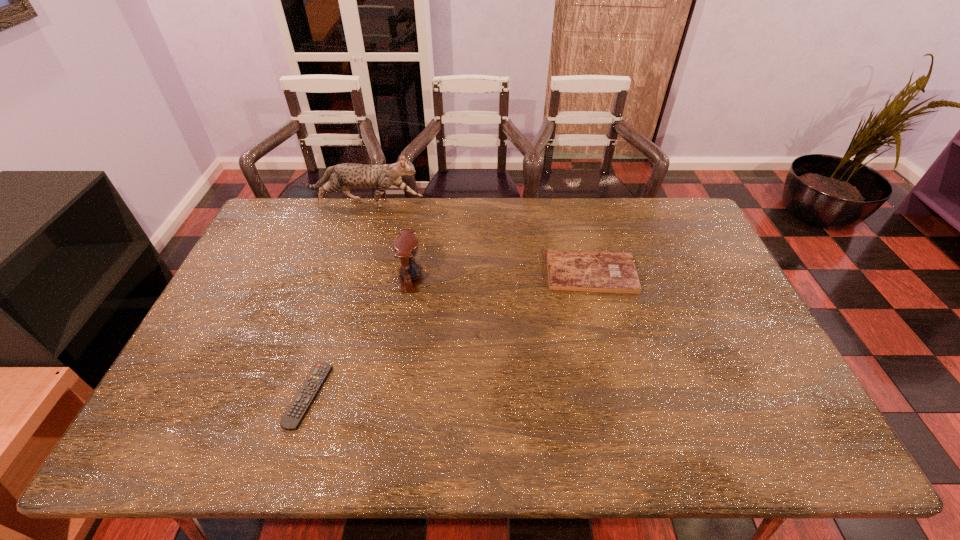
At what (x,y) coordinates should I click in order to perform the action: click on object that is the third nearest to the tallest object. Please return your answer as a coordinate pair (x, y). Looking at the image, I should click on (293, 417).

In order to click on object identified as the third closest to the remote control in this screenshot , I will do `click(347, 175)`.

Where is `vacant space that satisfies the following two spatial constraints: 1. on the face of the nearest object; 2. on the right side of the tallest object`? The width and height of the screenshot is (960, 540). vacant space that satisfies the following two spatial constraints: 1. on the face of the nearest object; 2. on the right side of the tallest object is located at coordinates [x=306, y=395].

Image resolution: width=960 pixels, height=540 pixels. I want to click on free region that satisfies the following two spatial constraints: 1. on the face of the farthest object; 2. on the left side of the hourglass, so click(x=342, y=279).

Locate an element on the screen. The height and width of the screenshot is (540, 960). vacant area in the image that satisfies the following two spatial constraints: 1. on the back side of the nearest object; 2. on the left side of the third tallest object is located at coordinates (346, 273).

Image resolution: width=960 pixels, height=540 pixels. Identify the location of free space in the image that satisfies the following two spatial constraints: 1. on the face of the nearest object; 2. on the left side of the farthest object. (306, 395).

Identify the location of vacant space that satisfies the following two spatial constraints: 1. on the back side of the Bible; 2. on the right side of the third shortest object. The width and height of the screenshot is (960, 540). (412, 273).